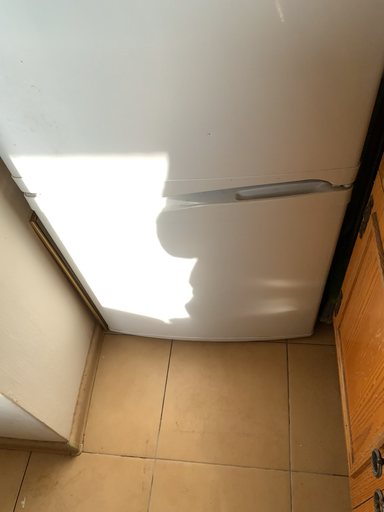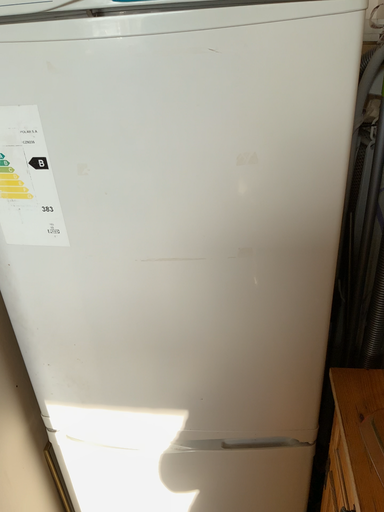
Question: How did the camera likely rotate when shooting the video?

Choices:
 (A) rotated upward
 (B) rotated downward

Answer: (A)